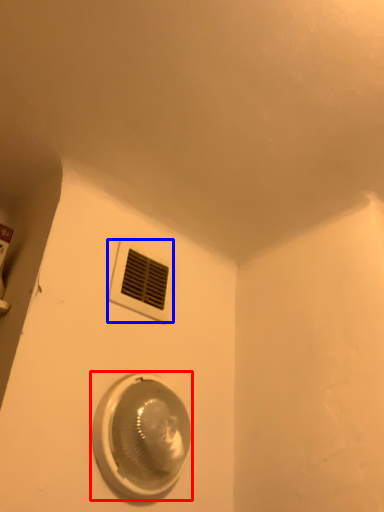
Question: Among these objects, which one is nearest to the camera, home appliance (highlighted by a red box) or window (highlighted by a blue box)?

Choices:
 (A) home appliance
 (B) window

Answer: (A)